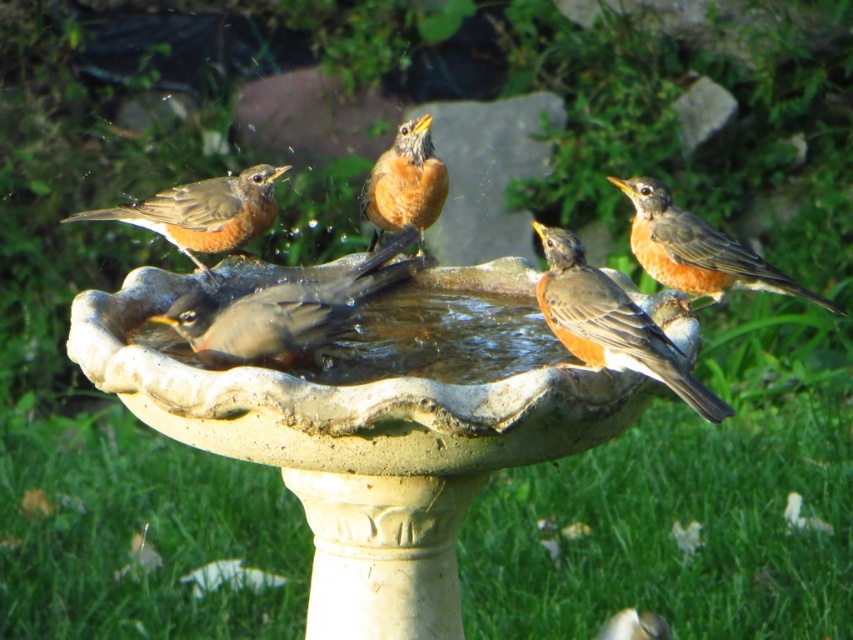
You are standing in the garden looking at the bird bath with the two points marked on it. Which of the two points, point (584, 275) or point (430, 172), is closer to you?

Point (584, 275) is closer to the viewer than point (430, 172).

You are a bird watcher observing the brown matte bird at left and the bright orange bird at center at the bird bath. Which bird has a larger width?

The brown matte bird at left might be wider than bright orange bird at center according to the description.